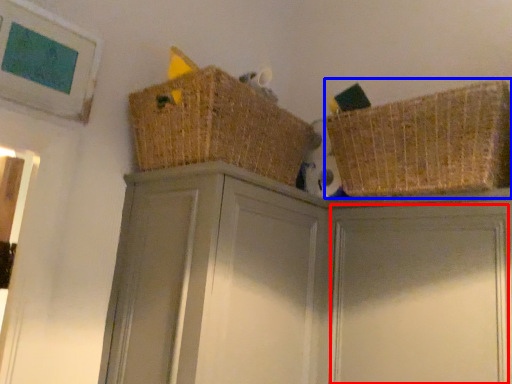
Question: Which object is further to the camera taking this photo, door (highlighted by a red box) or basket (highlighted by a blue box)?

Choices:
 (A) door
 (B) basket

Answer: (B)